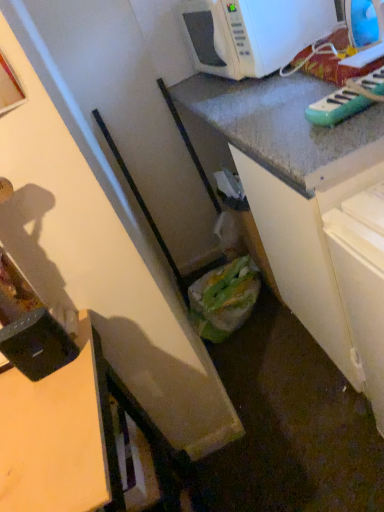
Identify the location of free space in front of green plastic bag at lower center. (264, 365).